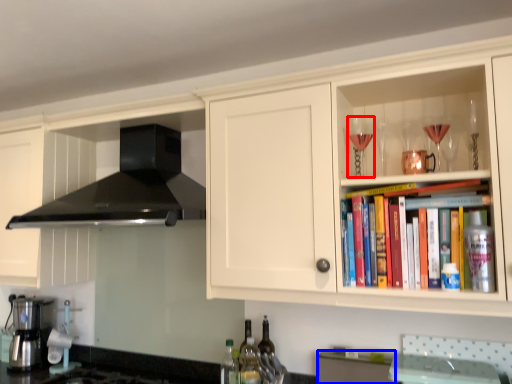
Question: Which object is closer to the camera taking this photo, wine glass (highlighted by a red box) or cabinetry (highlighted by a blue box)?

Choices:
 (A) wine glass
 (B) cabinetry

Answer: (A)